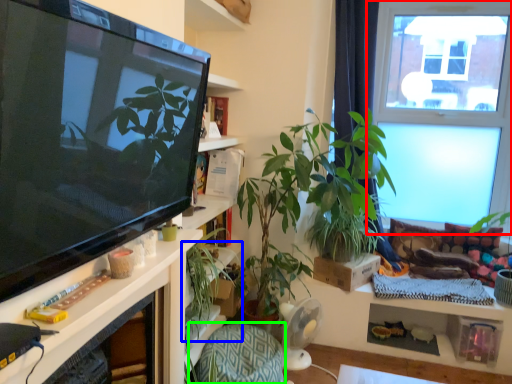
Question: Which object is positioned farthest from window (highlighted by a red box)? Select from houseplant (highlighted by a blue box) and armchair (highlighted by a green box).

Choices:
 (A) houseplant
 (B) armchair

Answer: (A)